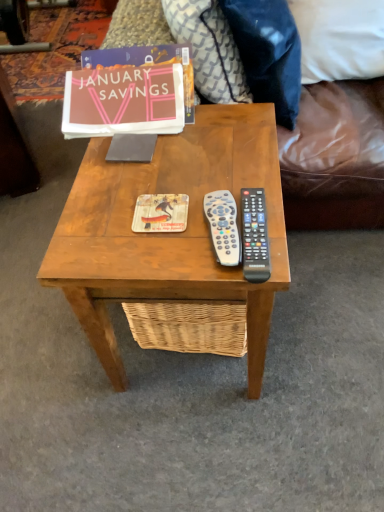
Where is `free space to the left of white plastic remote at center, arranged as the 2th remote control when viewed from the right`? free space to the left of white plastic remote at center, arranged as the 2th remote control when viewed from the right is located at coordinates (147, 231).